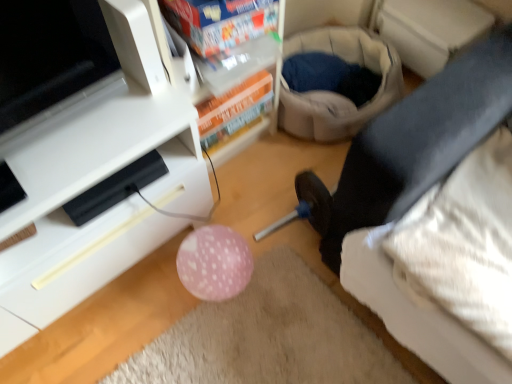
What do you see at coordinates (92, 175) in the screenshot?
I see `white glossy tv stand at lower left` at bounding box center [92, 175].

Locate an element on the screen. white glossy tv stand at lower left is located at coordinates (92, 175).

Is white glossy tv stand at lower left turned away from black fabric leg at lower right?

No, white glossy tv stand at lower left is not facing the opposite direction of black fabric leg at lower right.

Can you confirm if white glossy tv stand at lower left is positioned to the left of black fabric leg at lower right?

Yes.

From a real-world perspective, is white glossy tv stand at lower left positioned above or below black fabric leg at lower right?

From a real-world perspective, white glossy tv stand at lower left is physically above black fabric leg at lower right.

Consider the image. Is white glossy tv stand at lower left located outside black fabric leg at lower right?

Yes, white glossy tv stand at lower left is outside of black fabric leg at lower right.

Between white plastic shelf at upper center and black fabric leg at lower right, which one is positioned in front?

white plastic shelf at upper center.

Is white plastic shelf at upper center aimed at black fabric leg at lower right?

Yes, white plastic shelf at upper center is facing black fabric leg at lower right.

Consider the image. Can you tell me how much white plastic shelf at upper center and black fabric leg at lower right differ in facing direction?

The angle between the facing direction of white plastic shelf at upper center and the facing direction of black fabric leg at lower right is 97.2 degrees.

From the image's perspective, who appears lower, white plastic shelf at upper center or black fabric leg at lower right?

black fabric leg at lower right is shown below in the image.

From a real-world perspective, is white plastic shelf at upper center located beneath white glossy tv stand at lower left?

Actually, white plastic shelf at upper center is physically above white glossy tv stand at lower left in the real world.

Is white plastic shelf at upper center thinner than white glossy tv stand at lower left?

Yes.

Considering the relative sizes of white plastic shelf at upper center and white glossy tv stand at lower left in the image provided, is white plastic shelf at upper center bigger than white glossy tv stand at lower left?

Incorrect, white plastic shelf at upper center is not larger than white glossy tv stand at lower left.

From the image's perspective, does white plastic shelf at upper center appear lower than white glossy tv stand at lower left?

No, from the image's perspective, white plastic shelf at upper center is not below white glossy tv stand at lower left.

The width and height of the screenshot is (512, 384). I want to click on shelf that appears on the right of white glossy tv stand at lower left, so click(234, 70).

Which of these two, white glossy tv stand at lower left or white plastic shelf at upper center, is thinner?

Thinner between the two is white plastic shelf at upper center.

From a real-world perspective, does white glossy tv stand at lower left sit lower than white plastic shelf at upper center?

Yes.

Is black fabric leg at lower right aimed at white glossy tv stand at lower left?

No.

Would you say black fabric leg at lower right contains white glossy tv stand at lower left?

No, white glossy tv stand at lower left is not a part of black fabric leg at lower right.

Based on the photo, considering the relative sizes of black fabric leg at lower right and white glossy tv stand at lower left in the image provided, is black fabric leg at lower right taller than white glossy tv stand at lower left?

Incorrect, the height of black fabric leg at lower right is not larger of that of white glossy tv stand at lower left.

Is point (328, 245) less distant than point (28, 332)?

That is False.

Does point (419, 116) come behind point (233, 118)?

No, (419, 116) is in front of (233, 118).

Considering the sizes of objects black fabric leg at lower right and white plastic shelf at upper center in the image provided, who is bigger, black fabric leg at lower right or white plastic shelf at upper center?

white plastic shelf at upper center is bigger.

From the image's perspective, is black fabric leg at lower right over white plastic shelf at upper center?

No, from the image's perspective, black fabric leg at lower right is not above white plastic shelf at upper center.

Considering the relative sizes of black fabric leg at lower right and white plastic shelf at upper center in the image provided, is black fabric leg at lower right wider than white plastic shelf at upper center?

Correct, the width of black fabric leg at lower right exceeds that of white plastic shelf at upper center.

In the image, there is a white glossy tv stand at lower left. Where is `leg below it (from a real-world perspective)`? This screenshot has height=384, width=512. leg below it (from a real-world perspective) is located at coordinates (420, 141).

What are the coordinates of `leg below the white plastic shelf at upper center (from the image's perspective)` in the screenshot? It's located at (420, 141).

When comparing their distances from white plastic shelf at upper center, does white glossy tv stand at lower left or black fabric leg at lower right seem closer?

white glossy tv stand at lower left is closer to white plastic shelf at upper center.

Considering their positions, is black fabric leg at lower right positioned further to white glossy tv stand at lower left than white plastic shelf at upper center?

black fabric leg at lower right lies further to white glossy tv stand at lower left than the other object.

From the image, which object appears to be nearer to white plastic shelf at upper center, black fabric leg at lower right or white glossy tv stand at lower left?

white glossy tv stand at lower left is closer to white plastic shelf at upper center.

When comparing their distances from black fabric leg at lower right, does white plastic shelf at upper center or white glossy tv stand at lower left seem closer?

The object closer to black fabric leg at lower right is white plastic shelf at upper center.

Considering their positions, is white plastic shelf at upper center positioned further to white glossy tv stand at lower left than black fabric leg at lower right?

The object further to white glossy tv stand at lower left is black fabric leg at lower right.

When comparing their distances from black fabric leg at lower right, does white glossy tv stand at lower left or white plastic shelf at upper center seem further?

white glossy tv stand at lower left.

Where is `shelf situated between white glossy tv stand at lower left and black fabric leg at lower right from left to right`? shelf situated between white glossy tv stand at lower left and black fabric leg at lower right from left to right is located at coordinates (234, 70).